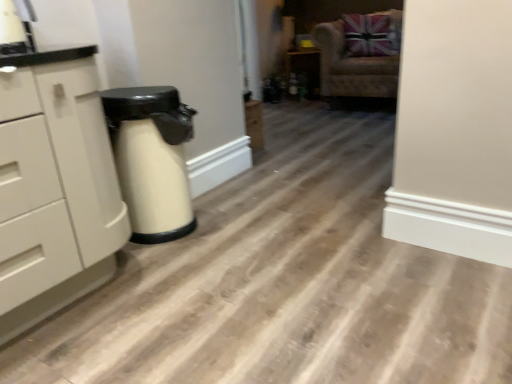
Question: Looking at their shapes, would you say velvet beige armchair at upper right is wider or thinner than white matte chest of drawers at left?

Choices:
 (A) wide
 (B) thin

Answer: (A)

Question: Is point (393, 49) closer or farther from the camera than point (39, 218)?

Choices:
 (A) closer
 (B) farther

Answer: (B)

Question: Which object is positioned closest to the velvet beige armchair at upper right?

Choices:
 (A) white matte chest of drawers at left
 (B) matte black cabinet at center

Answer: (B)

Question: Which is nearer to the velvet beige armchair at upper right?

Choices:
 (A) white matte chest of drawers at left
 (B) matte black cabinet at center

Answer: (B)